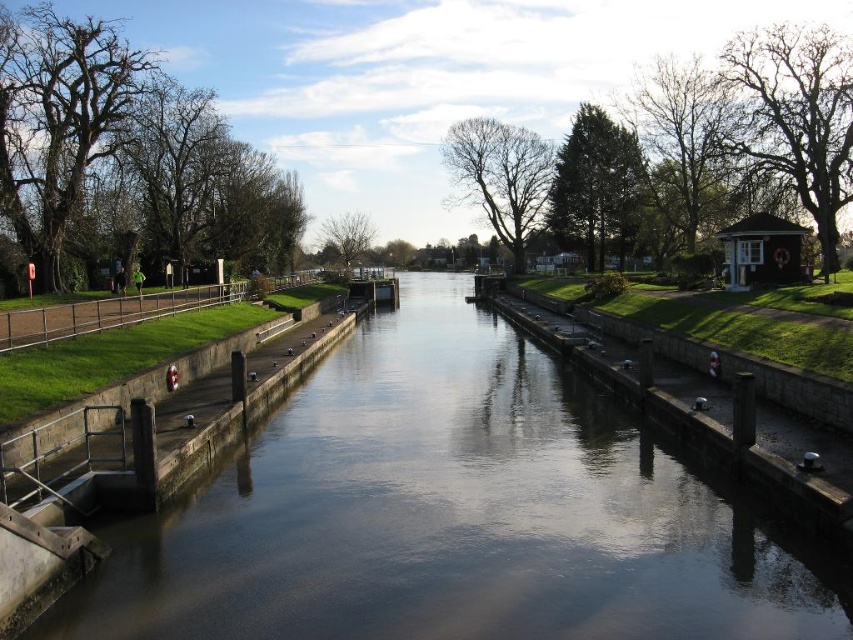
Who is more distant from viewer, (x=668, y=152) or (x=479, y=170)?

The point (x=479, y=170) is more distant.

Is point (700, 204) positioned behind point (457, 186)?

No, it is in front of (457, 186).

Which is in front, point (724, 100) or point (541, 193)?

Point (724, 100) is in front.

Where is `green leafy tree at upper right`? The image size is (853, 640). green leafy tree at upper right is located at coordinates (683, 141).

At what (x,y) coordinates should I click in order to perform the action: click on brown concrete river at center. Please return your answer as a coordinate pair (x, y). This screenshot has height=640, width=853. Looking at the image, I should click on (451, 513).

Can you confirm if brown concrete river at center is shorter than brown textured tree at upper right?

Indeed, brown concrete river at center has a lesser height compared to brown textured tree at upper right.

At what (x,y) coordinates should I click in order to perform the action: click on brown concrete river at center. Please return your answer as a coordinate pair (x, y). Looking at the image, I should click on (451, 513).

Who is taller, bare branches at center or green leafy tree at center?

bare branches at center

Between bare branches at center and green leafy tree at center, which one has less height?

With less height is green leafy tree at center.

You are a GUI agent. You are given a task and a screenshot of the screen. Output one action in this format:
    pyautogui.click(x=<x>, y=<y>)
    Task: Click on the bare branches at center
    
    Given the screenshot: What is the action you would take?
    pyautogui.click(x=500, y=177)

Find the location of a particular element. This screenshot has height=640, width=853. bare branches at center is located at coordinates (500, 177).